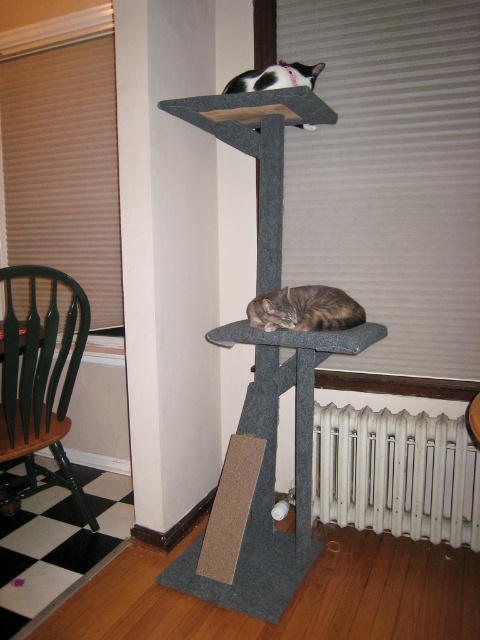
You are a cat owner who wants to place a new cat toy on the floor between the white metal radiator at lower center and the brown fur cat at lower center. Can you estimate if there is enough space for the cat toy?

The white metal radiator at lower center is taller than the brown fur cat at lower center, but the question is about space on the floor between them. The description does not provide information about the horizontal distance between these objects, so it is unclear if there is enough space for the cat toy.

In the scene shown: You are trying to place a small plant pot between the green wood chair at left and the brown fur cat at lower center. Based on their widths, which object should you place the pot closer to to ensure it fits?

The green wood chair at left is wider than the brown fur cat at lower center, so you should place the pot closer to the brown fur cat at lower center to ensure it fits.